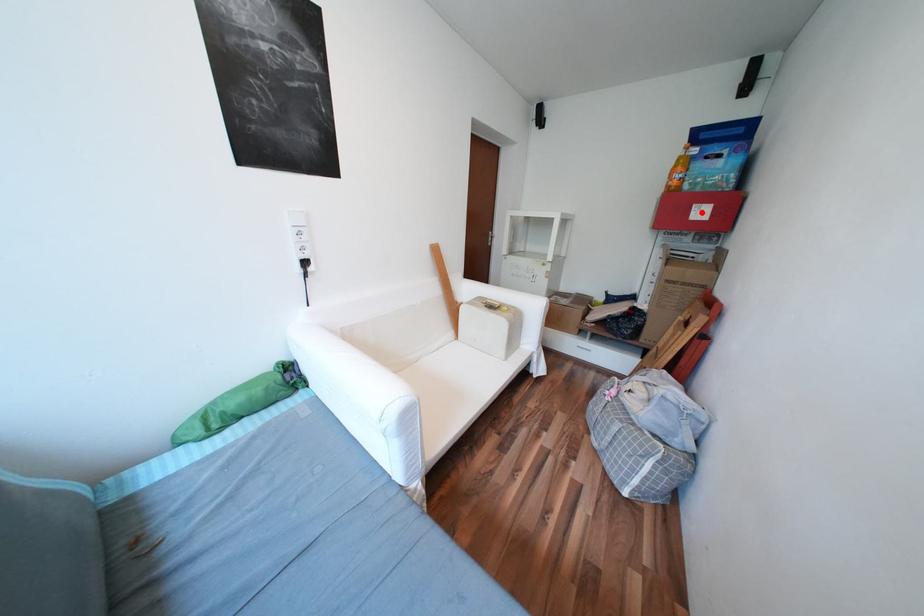
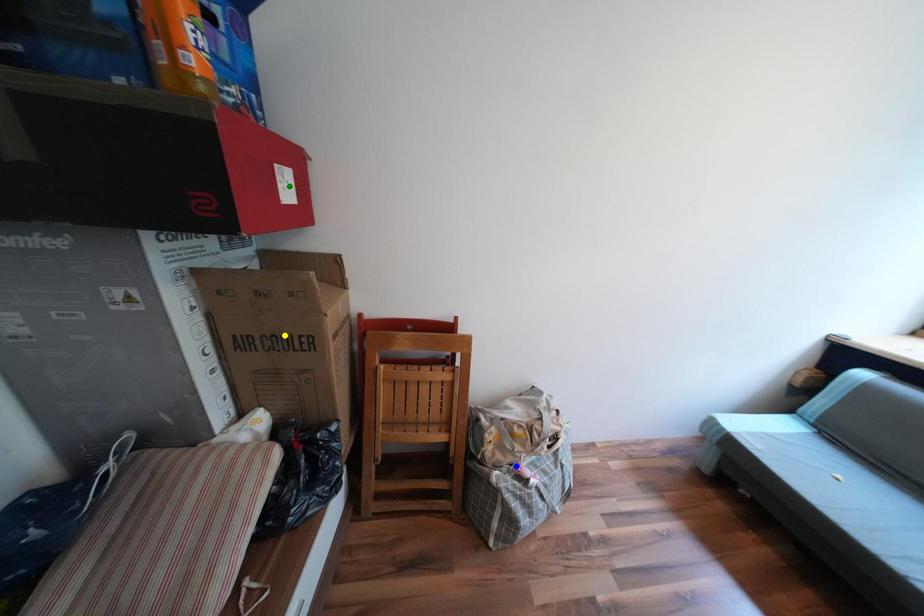
Question: I am providing you with two images of the same scene from different viewpoints. A red point is marked on the first image. You are given multiple points on the second image. Which point in image 2 is actually the same real-world point as the red point in image 1?

Choices:
 (A) yellow point
 (B) green point
 (C) blue point

Answer: (B)